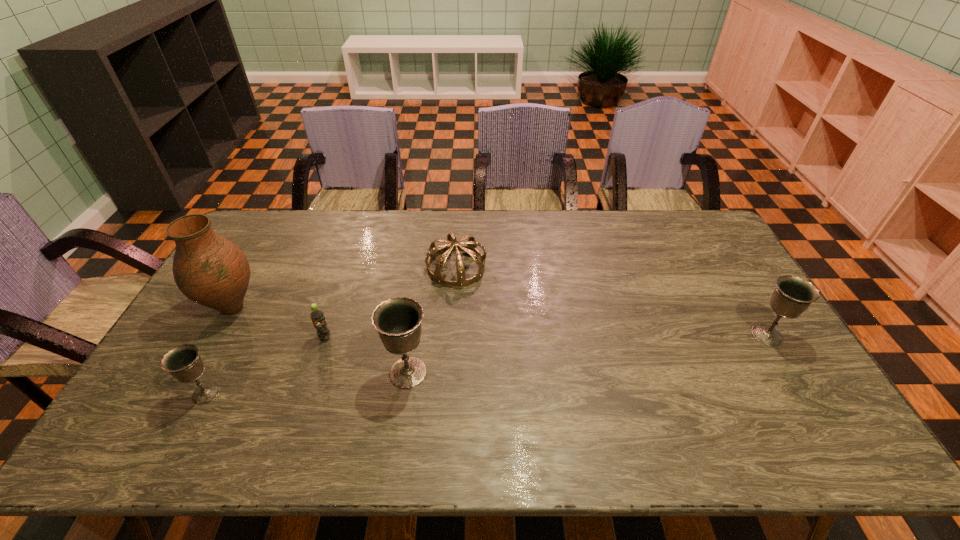
Where is `vacant position at the near edge of the desktop`? vacant position at the near edge of the desktop is located at coordinates (409, 410).

In the image, there is a desktop. Identify the location of vacant space at the left edge. The height and width of the screenshot is (540, 960). (262, 276).

Find the location of a particular element. Image resolution: width=960 pixels, height=540 pixels. free spot at the right edge of the desktop is located at coordinates (749, 322).

Image resolution: width=960 pixels, height=540 pixels. In the image, there is a desktop. Identify the location of free region at the far left corner. (290, 232).

The image size is (960, 540). I want to click on vacant space that is in between the tiara and the tallest object, so click(345, 288).

Image resolution: width=960 pixels, height=540 pixels. Find the location of `free space between the fifth shortest object and the soda`. free space between the fifth shortest object and the soda is located at coordinates (367, 355).

The width and height of the screenshot is (960, 540). What are the coordinates of `free point between the tiara and the rightmost object` in the screenshot? It's located at (612, 301).

Where is `free space between the second chalice from right to left and the leftmost chalice`? The image size is (960, 540). free space between the second chalice from right to left and the leftmost chalice is located at coordinates (307, 383).

Identify the location of vacant area between the rightmost chalice and the tiara. (612, 301).

Locate an element on the screen. This screenshot has width=960, height=540. vacant point located between the rightmost chalice and the soda is located at coordinates (546, 336).